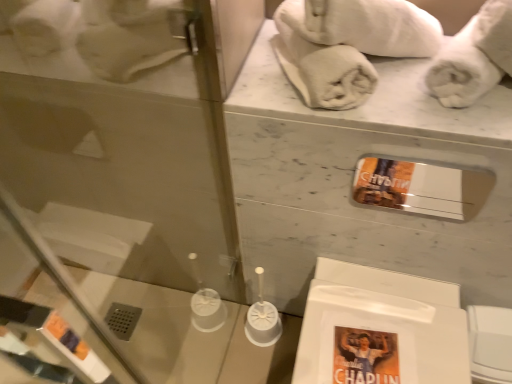
Question: From a real-world perspective, is transparent glass door at left physically located above or below white fluffy towel at upper right, acting as the first bath towel starting from the right?

Choices:
 (A) below
 (B) above

Answer: (A)

Question: From the image's perspective, relative to white fluffy towel at upper right, arranged as the 3th bath towel when viewed from the left, is transparent glass door at left above or below?

Choices:
 (A) above
 (B) below

Answer: (B)

Question: Which is farther from the white fluffy towel at upper right, acting as the first bath towel starting from the right?

Choices:
 (A) white cotton towel at upper center, which is the 1th bath towel in left-to-right order
 (B) transparent glass door at left
 (C) white soft towel at upper right, the second bath towel when ordered from left to right

Answer: (B)

Question: Which is nearer to the transparent glass door at left?

Choices:
 (A) white cotton towel at upper center, the 3th bath towel positioned from the right
 (B) white soft towel at upper right, the second bath towel in the right-to-left sequence
 (C) white fluffy towel at upper right, acting as the first bath towel starting from the right

Answer: (B)